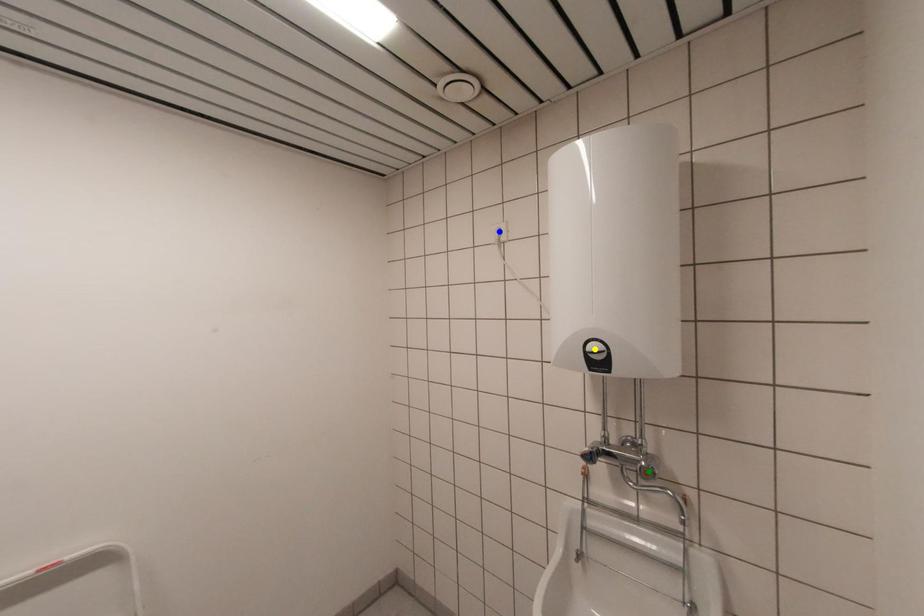
Order these from nearest to farthest:
green point, yellow point, blue point

yellow point → green point → blue point